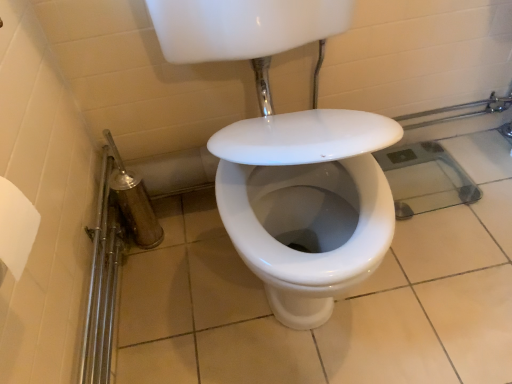
What is the approximate height of white glossy sink at center?

white glossy sink at center is 37.06 inches tall.

The width and height of the screenshot is (512, 384). What are the coordinates of `white glossy sink at center` in the screenshot? It's located at click(289, 157).

In order to face white glossy sink at center, should I rotate leftwards or rightwards?

Rotate right and turn 4.871 degrees.

Describe the element at coordinates (289, 157) in the screenshot. Image resolution: width=512 pixels, height=384 pixels. I see `white glossy sink at center` at that location.

Measure the distance between point (353, 112) and camera.

Point (353, 112) and camera are 35.28 inches apart from each other.

What do you see at coordinates (134, 201) in the screenshot? I see `shiny metallic shower at lower left` at bounding box center [134, 201].

Locate an element on the screen. This screenshot has width=512, height=384. shiny metallic shower at lower left is located at coordinates (134, 201).

What is the approximate width of shiny metallic shower at lower left?

shiny metallic shower at lower left is 7.24 inches in width.

The width and height of the screenshot is (512, 384). Identify the location of white glossy sink at center. (289, 157).

Considering the relative positions of shiny metallic shower at lower left and white glossy sink at center in the image provided, is shiny metallic shower at lower left to the left or to the right of white glossy sink at center?

Clearly, shiny metallic shower at lower left is on the left of white glossy sink at center in the image.

Which object is closer to the camera, shiny metallic shower at lower left or white glossy sink at center?

white glossy sink at center is closer to the camera.

Considering the positions of points (126, 175) and (194, 51), is point (126, 175) farther from camera compared to point (194, 51)?

Yes, it is.

From the image's perspective, relative to white glossy sink at center, is shiny metallic shower at lower left above or below?

shiny metallic shower at lower left is below white glossy sink at center.

From a real-world perspective, is shiny metallic shower at lower left physically located above or below white glossy sink at center?

shiny metallic shower at lower left is situated lower than white glossy sink at center in the real world.

Which object is wider, shiny metallic shower at lower left or white glossy sink at center?

white glossy sink at center is wider.

Is shiny metallic shower at lower left shorter than white glossy sink at center?

Yes, shiny metallic shower at lower left is shorter than white glossy sink at center.

Which of these two, shiny metallic shower at lower left or white glossy sink at center, is bigger?

Bigger between the two is white glossy sink at center.

Could white glossy sink at center be considered to be inside shiny metallic shower at lower left?

No.

Would you consider shiny metallic shower at lower left to be distant from white glossy sink at center?

No, shiny metallic shower at lower left is in close proximity to white glossy sink at center.

Consider the image. Could you tell me if shiny metallic shower at lower left is turned towards white glossy sink at center?

No, shiny metallic shower at lower left is not oriented towards white glossy sink at center.

This screenshot has height=384, width=512. What are the coordinates of `shower below the white glossy sink at center (from the image's perspective)` in the screenshot? It's located at (134, 201).

Is white glossy sink at center to the right of shiny metallic shower at lower left from the viewer's perspective?

Indeed, white glossy sink at center is positioned on the right side of shiny metallic shower at lower left.

Between white glossy sink at center and shiny metallic shower at lower left, which one is positioned behind?

shiny metallic shower at lower left is behind.

Is point (381, 228) farther from viewer compared to point (146, 231)?

No, (381, 228) is closer to viewer.

From the image's perspective, is white glossy sink at center above or below shiny metallic shower at lower left?

Based on their image positions, white glossy sink at center is located above shiny metallic shower at lower left.

Looking at this image, from a real-world perspective, is white glossy sink at center positioned under shiny metallic shower at lower left based on gravity?

No, from a real-world perspective, white glossy sink at center is not under shiny metallic shower at lower left.

Considering the sizes of objects white glossy sink at center and shiny metallic shower at lower left in the image provided, who is thinner, white glossy sink at center or shiny metallic shower at lower left?

shiny metallic shower at lower left.

Between white glossy sink at center and shiny metallic shower at lower left, which one has less height?

With less height is shiny metallic shower at lower left.

Can you confirm if white glossy sink at center is smaller than shiny metallic shower at lower left?

No, white glossy sink at center is not smaller than shiny metallic shower at lower left.

In the scene shown: Would you say shiny metallic shower at lower left is part of white glossy sink at center's contents?

No, shiny metallic shower at lower left is not a part of white glossy sink at center.

Are white glossy sink at center and shiny metallic shower at lower left far apart?

No, white glossy sink at center is not far from shiny metallic shower at lower left.

Consider the image. Is white glossy sink at center facing towards shiny metallic shower at lower left?

No, white glossy sink at center does not turn towards shiny metallic shower at lower left.

The image size is (512, 384). In the image, there is a shiny metallic shower at lower left. Find the location of `sink above it (from the image's perspective)`. sink above it (from the image's perspective) is located at coordinates (289, 157).

Locate an element on the screen. The height and width of the screenshot is (384, 512). sink in front of the shiny metallic shower at lower left is located at coordinates (289, 157).

Where is `shower below the white glossy sink at center (from a real-world perspective)`? The height and width of the screenshot is (384, 512). shower below the white glossy sink at center (from a real-world perspective) is located at coordinates (134, 201).